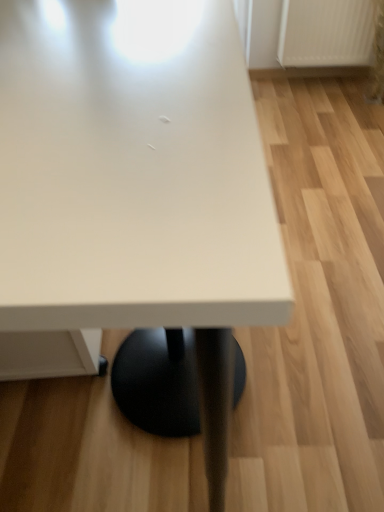
Describe the element at coordinates (326, 33) in the screenshot. I see `white plastic radiator at upper right` at that location.

In order to face white plastic radiator at upper right, should I rotate leftwards or rightwards?

To align with it, rotate right about 20.252°.

Identify the location of white plastic radiator at upper right. (326, 33).

Find the location of `white plastic radiator at upper right`. white plastic radiator at upper right is located at coordinates (326, 33).